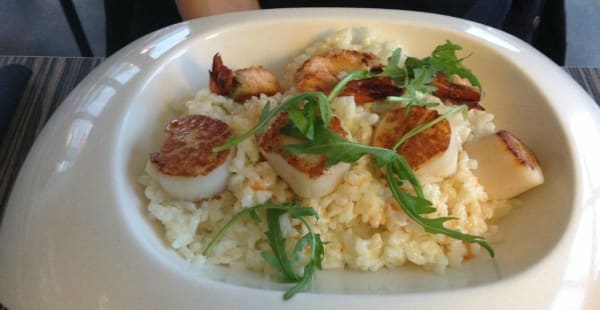
This screenshot has width=600, height=310. In order to click on reflected light on rim of left side of plate in this screenshot , I will do `click(167, 42)`, `click(118, 74)`, `click(92, 102)`, `click(74, 139)`, `click(62, 169)`.